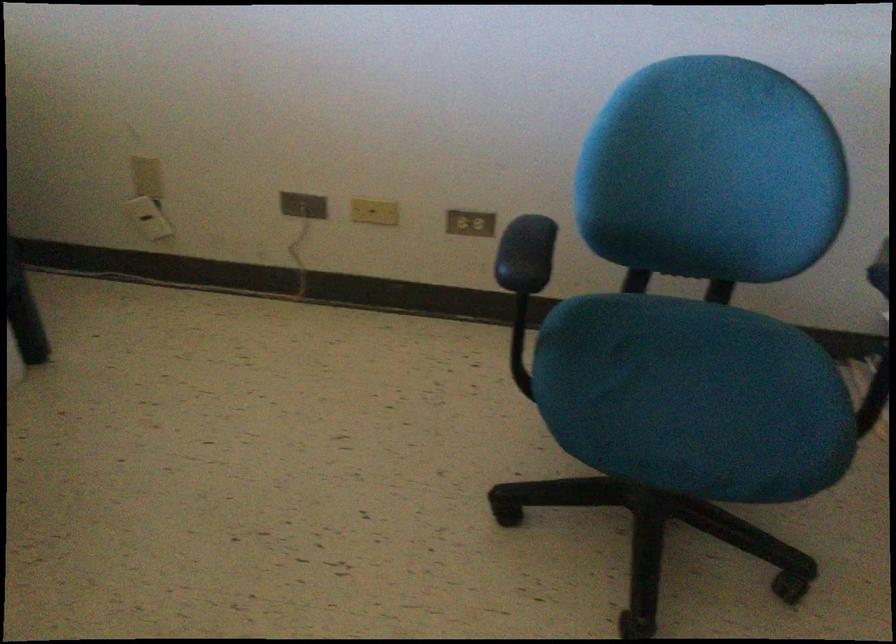
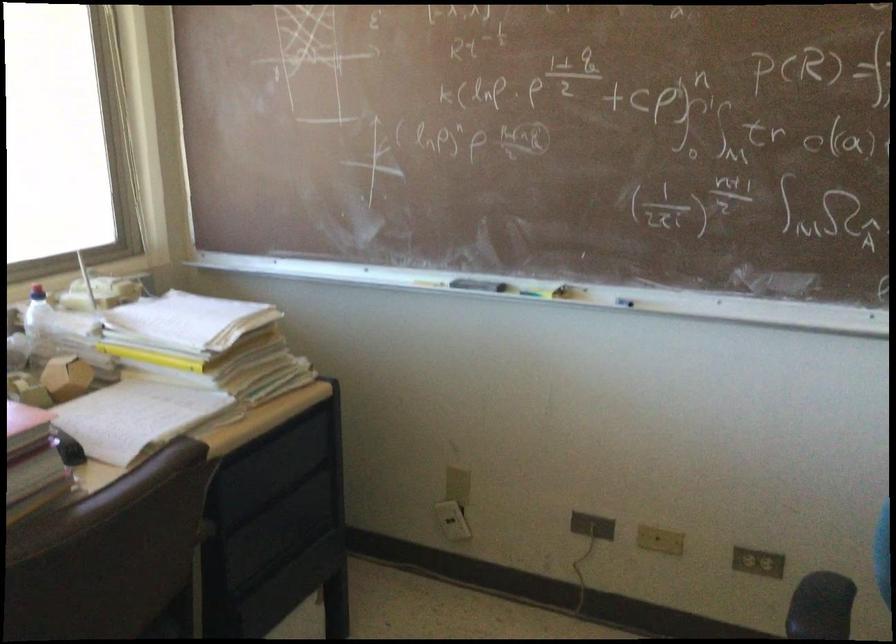
Where in the second image is the point corresponding to the point at 142,219 from the first image?

(452, 520)